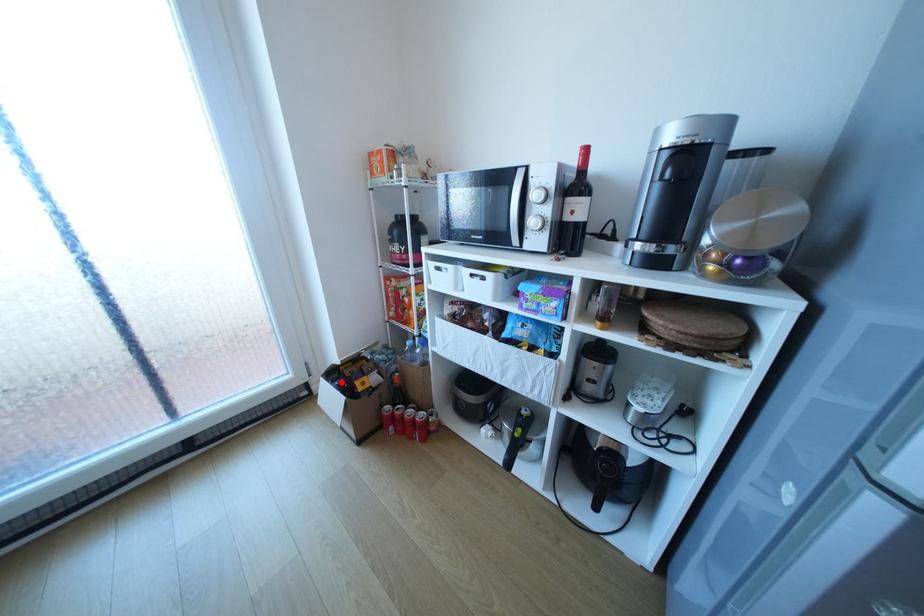
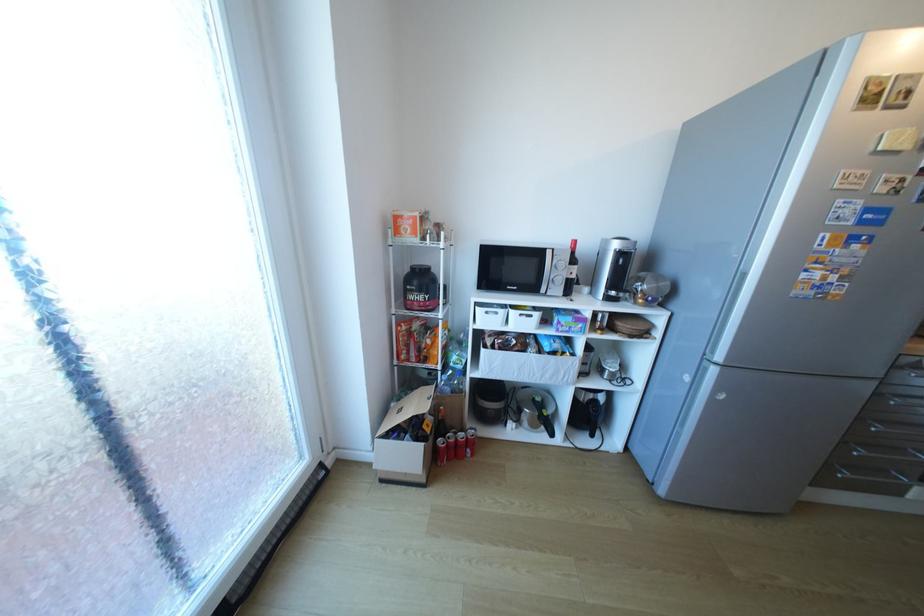
Question: I am providing you with two images of the same scene from different viewpoints. A red point is shown in image1. For the corresponding object point in image2, is it positioned nearer or farther from the camera?

Choices:
 (A) Nearer
 (B) Farther

Answer: (B)